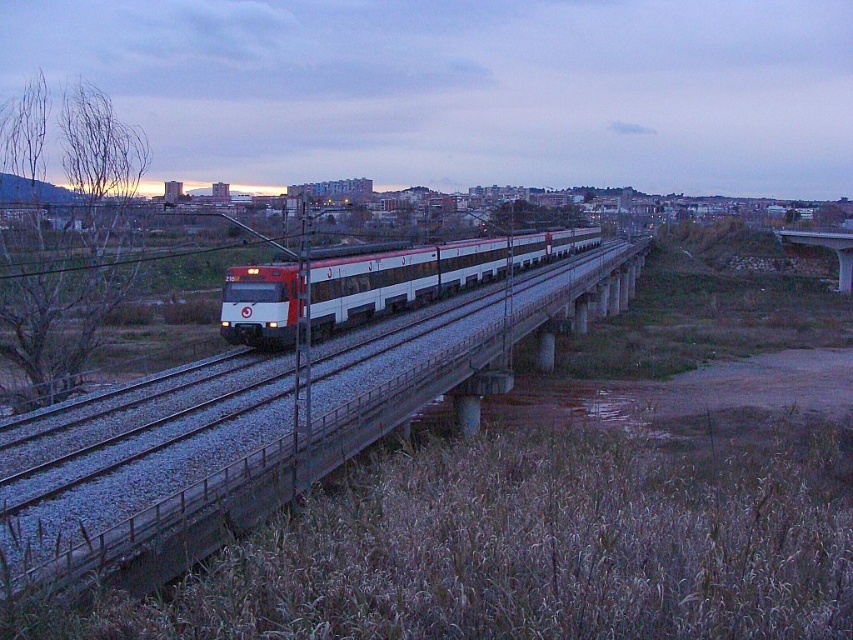
Does white glossy passenger train at center have a larger size compared to concrete bridge at right?

Indeed, white glossy passenger train at center has a larger size compared to concrete bridge at right.

Which of these two, white glossy passenger train at center or concrete bridge at right, stands taller?

concrete bridge at right is taller.

Which is in front, point (233, 307) or point (804, 243)?

Positioned in front is point (233, 307).

The width and height of the screenshot is (853, 640). In order to click on white glossy passenger train at center in this screenshot , I will do `click(422, 273)`.